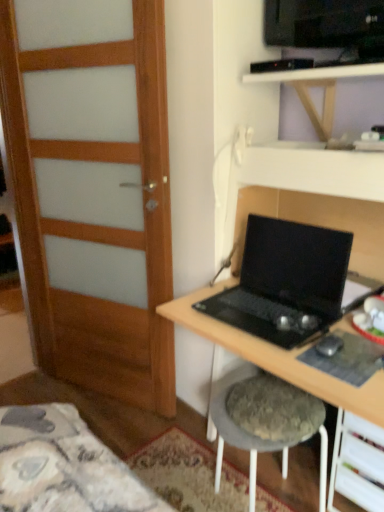
Locate an element on the screen. This screenshot has height=512, width=384. vacant area that is situated to the right of black rubber mouse at lower right is located at coordinates (358, 348).